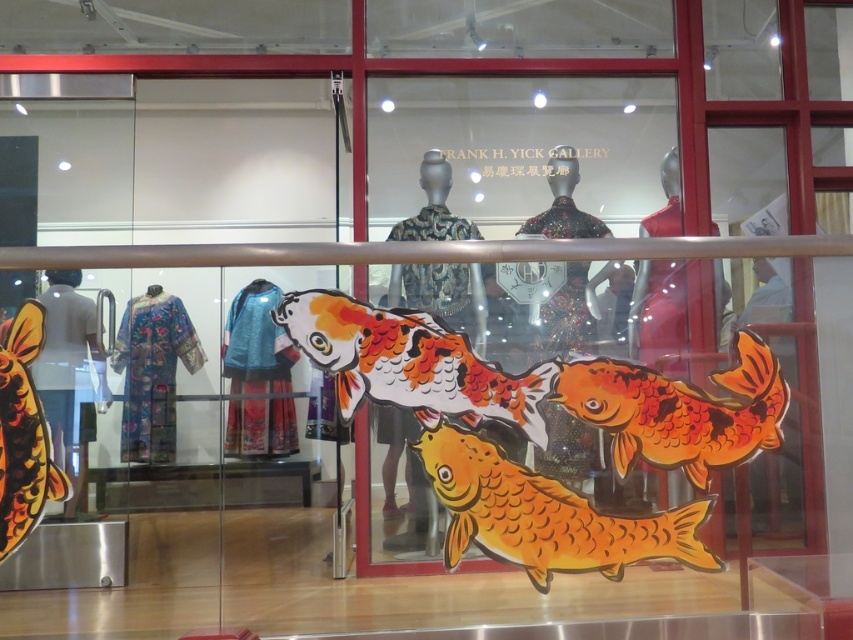
You are an art student visiting the FRANK H. YICK GALLERY. You notice two fish displays in the foreground of the exhibit. The first is the orange and white painted fish at center, and the second is the shiny orange fish at lower left. Which fish display is taller?

The shiny orange fish at lower left is taller than the orange and white painted fish at center.

You are standing in front of the FRANK H. YICK GALLERY display window. There is an orange matte fish at center. If you want to touch the fish, which direction should you move relative to your current position?

The orange matte fish at center is located at coordinates point [544,515], so you should move towards the center of the display window to reach it.

You are standing in front of the FRANK H. YICK GALLERY display window. There is a point marked at coordinate (680, 410). What object is located at this coordinate?

The point at coordinate (680, 410) corresponds to the orange glossy koi at center.